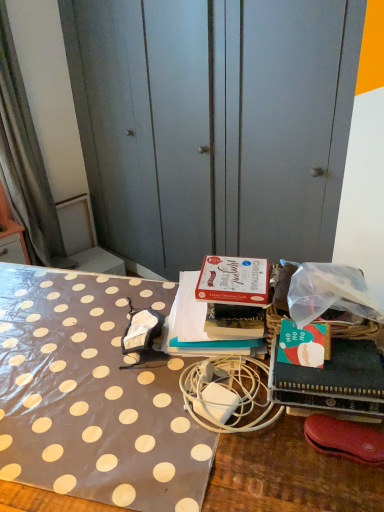
Identify the location of vacant space that is to the left of leather-like red shoe at lower right. This screenshot has width=384, height=512. (263, 460).